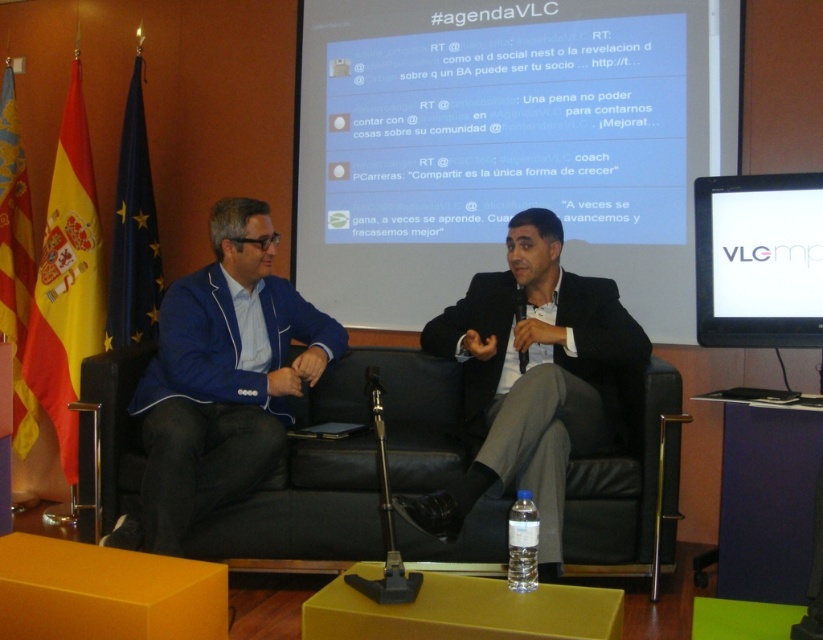
You are a photographer positioned behind the camera. You need to capture a photo of both the black leather couch at center and the blue fabric jacket at center. Which object should you adjust your camera angle to focus on first if you want to include both in the frame without moving the camera?

The blue fabric jacket at center is to the left of the black leather couch at center, so you should adjust your camera angle to focus on the blue fabric jacket at center first to ensure both objects are in the frame without moving the camera.

You are an interior designer analyzing the placement of furniture in the room. The blue fabric jacket at center is located at coordinates point 0.589, 0.272. Is this position considered the center of the room?

The blue fabric jacket at center is located at point (222, 376), which matches the center coordinates of the room. Therefore, this position is indeed the center of the room.

You are a photographer taking a picture of the scene. You want to focus on the point at coordinates point (301, 509). Where exactly is this point located in the scene?

The point (301, 509) is located on the black leather couch at center.